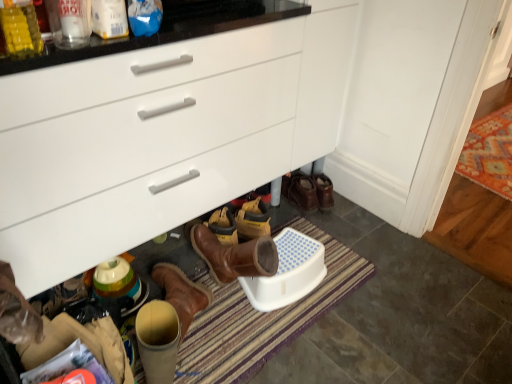
Find the location of `free space in front of leather shoes at center`. free space in front of leather shoes at center is located at coordinates (294, 219).